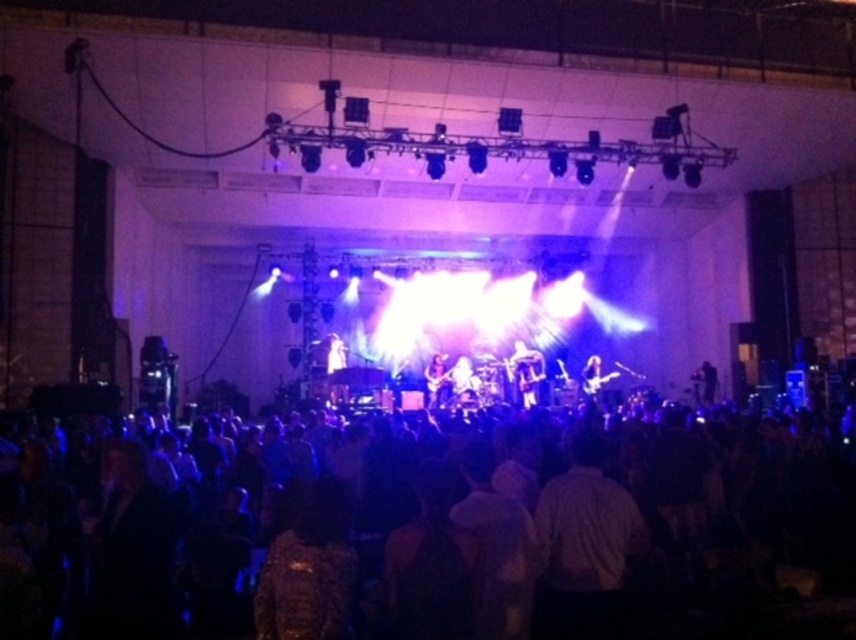
Based on the photo, does black fabric crowd at lower center appear under shiny silver guitar at center?

Indeed, black fabric crowd at lower center is positioned under shiny silver guitar at center.

Is point (804, 541) positioned in front of point (544, 364)?

Yes, it is in front of point (544, 364).

The image size is (856, 640). In order to click on black fabric crowd at lower center in this screenshot , I will do point(575,540).

Which is above, black fabric crowd at lower center or shiny black guitar at center?

shiny black guitar at center is higher up.

Is black fabric crowd at lower center to the left of shiny black guitar at center from the viewer's perspective?

In fact, black fabric crowd at lower center is to the right of shiny black guitar at center.

The width and height of the screenshot is (856, 640). Identify the location of black fabric crowd at lower center. (575, 540).

I want to click on black fabric crowd at lower center, so click(575, 540).

Can you confirm if shiny silver guitar at center is taller than shiny black guitar at center?

Indeed, shiny silver guitar at center has a greater height compared to shiny black guitar at center.

Does shiny silver guitar at center have a lesser height compared to shiny black guitar at center?

Incorrect, shiny silver guitar at center's height does not fall short of shiny black guitar at center's.

Is point (516, 369) positioned behind point (437, 396)?

Yes, it is behind point (437, 396).

Image resolution: width=856 pixels, height=640 pixels. In order to click on shiny silver guitar at center in this screenshot , I will do `click(526, 372)`.